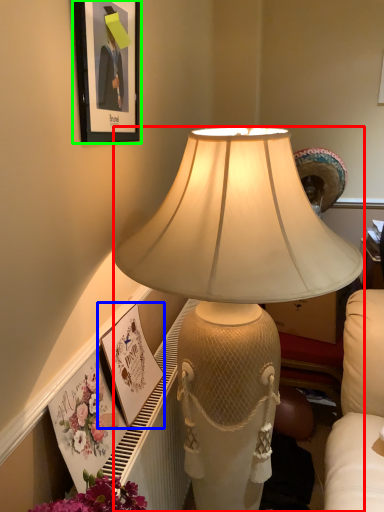
Question: Which object is the farthest from lamp (highlighted by a red box)? Choose among these: picture frame (highlighted by a blue box) or picture frame (highlighted by a green box).

Choices:
 (A) picture frame
 (B) picture frame

Answer: (A)